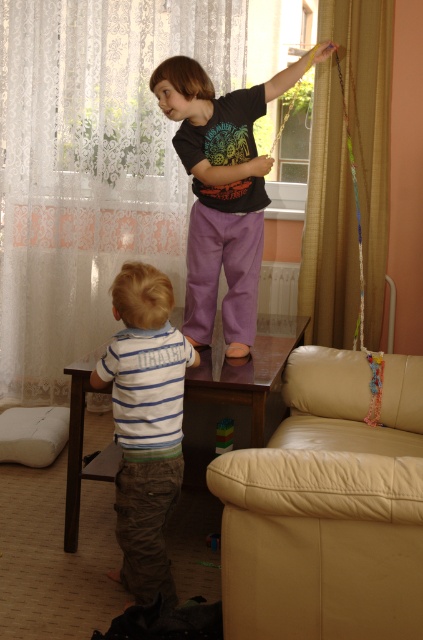
Which is more to the right, gold textured curtain at upper right or multicolored plastic blocks at lower center?

From the viewer's perspective, gold textured curtain at upper right appears more on the right side.

The image size is (423, 640). What do you see at coordinates (367, 128) in the screenshot? I see `gold textured curtain at upper right` at bounding box center [367, 128].

At what (x,y) coordinates should I click in order to perform the action: click on gold textured curtain at upper right. Please return your answer as a coordinate pair (x, y). This screenshot has height=640, width=423. Looking at the image, I should click on [367, 128].

This screenshot has height=640, width=423. What are the coordinates of `gold textured curtain at upper right` in the screenshot? It's located at (367, 128).

Does matte black t-shirt at upper center appear on the right side of wooden toy at lower center?

Correct, you'll find matte black t-shirt at upper center to the right of wooden toy at lower center.

Is matte black t-shirt at upper center closer to the viewer compared to wooden toy at lower center?

Yes, it is in front of wooden toy at lower center.

This screenshot has height=640, width=423. I want to click on matte black t-shirt at upper center, so click(206, 140).

I want to click on matte black t-shirt at upper center, so click(x=206, y=140).

In the scene shown: Measure the distance between brown wooden side table at center and camera.

A distance of 8.11 feet exists between brown wooden side table at center and camera.

Is brown wooden side table at center closer to camera compared to wooden toy at lower center?

Yes, it is.

Which is in front, point (200, 368) or point (213, 548)?

Positioned in front is point (200, 368).

This screenshot has width=423, height=640. I want to click on brown wooden side table at center, so coord(247,369).